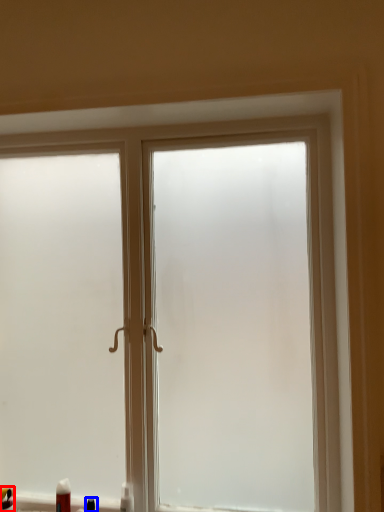
Question: Among these objects, which one is nearest to the camera, toiletry (highlighted by a red box) or toiletry (highlighted by a blue box)?

Choices:
 (A) toiletry
 (B) toiletry

Answer: (B)